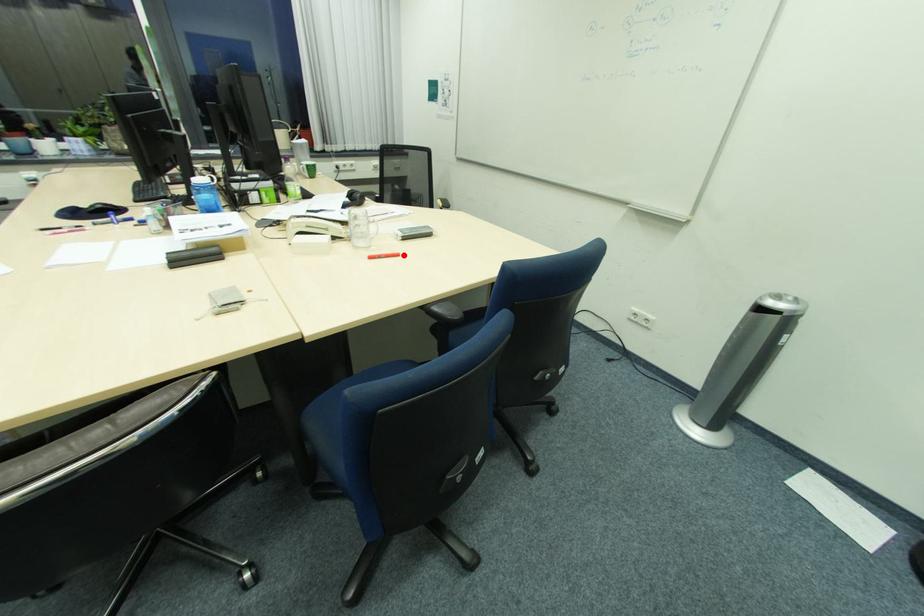
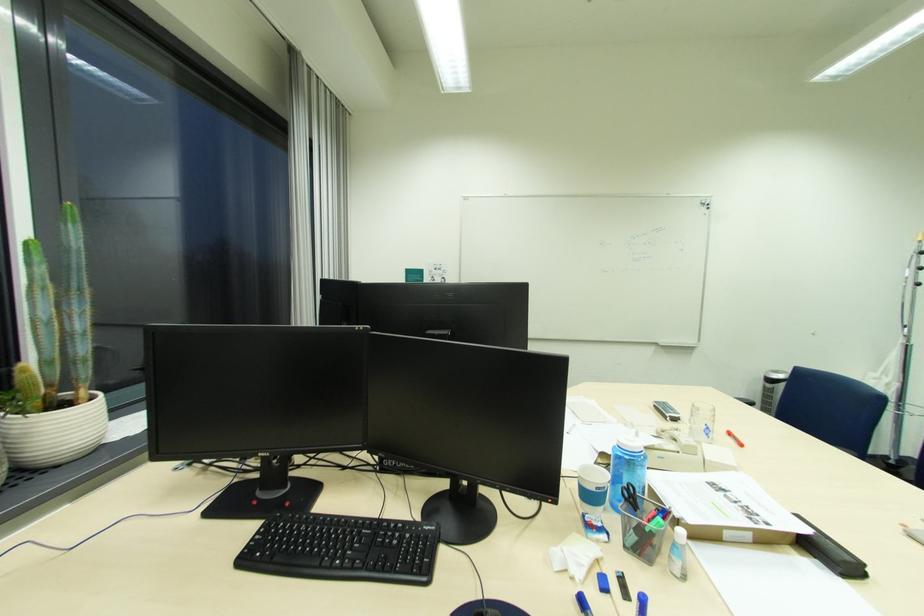
In the second image, find the point that corresponds to the highlighted location in the first image.

(736, 435)